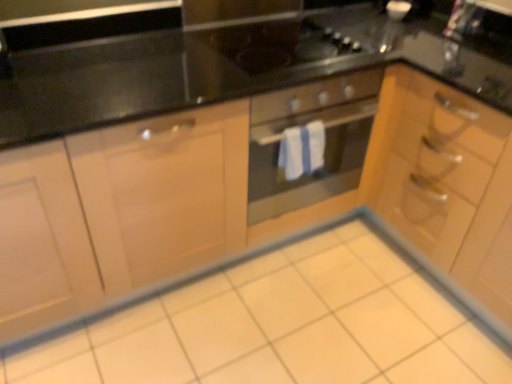
The height and width of the screenshot is (384, 512). In order to click on white glossy tile at center in this screenshot , I will do `click(279, 325)`.

Describe the element at coordinates (325, 141) in the screenshot. I see `stainless steel oven at center` at that location.

Where is `white glossy tile at center`? Image resolution: width=512 pixels, height=384 pixels. white glossy tile at center is located at coordinates (279, 325).

In terms of width, does stainless steel oven at center look wider or thinner when compared to white glossy tile at center?

Considering their sizes, stainless steel oven at center looks slimmer than white glossy tile at center.

Considering the relative sizes of stainless steel oven at center and white glossy tile at center in the image provided, is stainless steel oven at center taller than white glossy tile at center?

Correct, stainless steel oven at center is much taller as white glossy tile at center.

Does stainless steel oven at center contain white glossy tile at center?

Definitely not — white glossy tile at center is not inside stainless steel oven at center.

Considering the positions of objects stainless steel oven at center and white glossy tile at center in the image provided, who is more to the left, stainless steel oven at center or white glossy tile at center?

white glossy tile at center is more to the left.

From a real-world perspective, is stainless steel oven at center positioned over wooden cabinet at right based on gravity?

Yes, from a real-world perspective, stainless steel oven at center is over wooden cabinet at right

Which object is thinner, stainless steel oven at center or wooden cabinet at right?

stainless steel oven at center is thinner.

From the picture: Can you confirm if stainless steel oven at center is taller than wooden cabinet at right?

Incorrect, the height of stainless steel oven at center is not larger of that of wooden cabinet at right.

Considering the relative sizes of stainless steel oven at center and wooden cabinet at right in the image provided, is stainless steel oven at center bigger than wooden cabinet at right?

Incorrect, stainless steel oven at center is not larger than wooden cabinet at right.

Consider the image. Which is more to the left, black glass gas stove at center or white glossy tile at center?

white glossy tile at center.

Locate an element on the screen. The image size is (512, 384). ceramic tile on the left of black glass gas stove at center is located at coordinates (279, 325).

Which object is more forward, black glass gas stove at center or white glossy tile at center?

white glossy tile at center is closer to the camera.

Does black glass gas stove at center have a greater width compared to white glossy tile at center?

In fact, black glass gas stove at center might be narrower than white glossy tile at center.

Looking at their sizes, would you say white glossy tile at center is wider or thinner than wooden cabinet at right?

In the image, white glossy tile at center appears to be wider than wooden cabinet at right.

Can you tell me how much white glossy tile at center and wooden cabinet at right differ in facing direction?

The angle between the facing direction of white glossy tile at center and the facing direction of wooden cabinet at right is 90 degrees.

Does white glossy tile at center turn towards wooden cabinet at right?

No.

Considering the positions of objects white glossy tile at center and wooden cabinet at right in the image provided, who is behind, white glossy tile at center or wooden cabinet at right?

Positioned behind is wooden cabinet at right.

Is black glass gas stove at center outside of stainless steel oven at center?

Yes.

Where is `gas stove behind the stainless steel oven at center`? Image resolution: width=512 pixels, height=384 pixels. gas stove behind the stainless steel oven at center is located at coordinates coord(278,44).

Is point (265, 39) less distant than point (354, 88)?

No.

Where is `gas stove that appears behind the white glossy tile at center`? The height and width of the screenshot is (384, 512). gas stove that appears behind the white glossy tile at center is located at coordinates (278, 44).

Is white glossy tile at center positioned behind black glass gas stove at center?

No.

Can you tell me how much white glossy tile at center and black glass gas stove at center differ in facing direction?

The facing directions of white glossy tile at center and black glass gas stove at center are 0.625 degrees apart.

Is white glossy tile at center looking in the opposite direction of black glass gas stove at center?

No, black glass gas stove at center is not at the back of white glossy tile at center.

Is white glossy tile at center positioned beyond the bounds of stainless steel oven at center?

Indeed, white glossy tile at center is completely outside stainless steel oven at center.

Is point (253, 261) closer to camera compared to point (336, 185)?

No.

Would you consider white glossy tile at center to be distant from stainless steel oven at center?

No, white glossy tile at center is in close proximity to stainless steel oven at center.

The height and width of the screenshot is (384, 512). In the image, there is a stainless steel oven at center. What are the coordinates of `ceramic tile below it (from a real-world perspective)` in the screenshot? It's located at (279, 325).

The width and height of the screenshot is (512, 384). I want to click on ceramic tile in front of the stainless steel oven at center, so click(279, 325).

This screenshot has width=512, height=384. There is a wooden cabinet at right. Identify the location of oven above it (from a real-world perspective). (325, 141).

From the image, which object appears to be farther from white glossy tile at center, wooden cabinet at right or stainless steel oven at center?

Based on the image, wooden cabinet at right appears to be further to white glossy tile at center.

When comparing their distances from black glass gas stove at center, does stainless steel oven at center or white glossy tile at center seem further?

white glossy tile at center lies further to black glass gas stove at center than the other object.

When comparing their distances from white glossy tile at center, does wooden cabinet at right or black glass gas stove at center seem further?

black glass gas stove at center is positioned further to the anchor white glossy tile at center.

Which object lies further to the anchor point stainless steel oven at center, white glossy tile at center or black glass gas stove at center?

The object further to stainless steel oven at center is white glossy tile at center.

Considering their positions, is white glossy tile at center positioned further to black glass gas stove at center than wooden cabinet at right?

white glossy tile at center is further to black glass gas stove at center.

When comparing their distances from stainless steel oven at center, does black glass gas stove at center or wooden cabinet at right seem closer?

black glass gas stove at center is closer to stainless steel oven at center.

Estimate the real-world distances between objects in this image. Which object is closer to white glossy tile at center, black glass gas stove at center or wooden cabinet at right?

wooden cabinet at right is positioned closer to the anchor white glossy tile at center.

Which object lies further to the anchor point white glossy tile at center, black glass gas stove at center or stainless steel oven at center?

black glass gas stove at center is positioned further to the anchor white glossy tile at center.

Locate an element on the screen. oven situated between black glass gas stove at center and wooden cabinet at right from left to right is located at coordinates (325, 141).

The width and height of the screenshot is (512, 384). I want to click on oven between white glossy tile at center and wooden cabinet at right from left to right, so click(325, 141).

This screenshot has height=384, width=512. In order to click on cabinetry between black glass gas stove at center and white glossy tile at center vertically in this screenshot , I will do `click(445, 181)`.

Locate an element on the screen. This screenshot has width=512, height=384. oven between black glass gas stove at center and white glossy tile at center in the vertical direction is located at coordinates (325, 141).